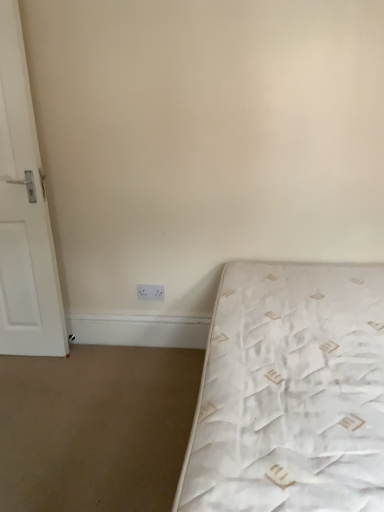
This screenshot has width=384, height=512. Identify the location of free spot below white matte door at left (from a real-world perspective). (29, 357).